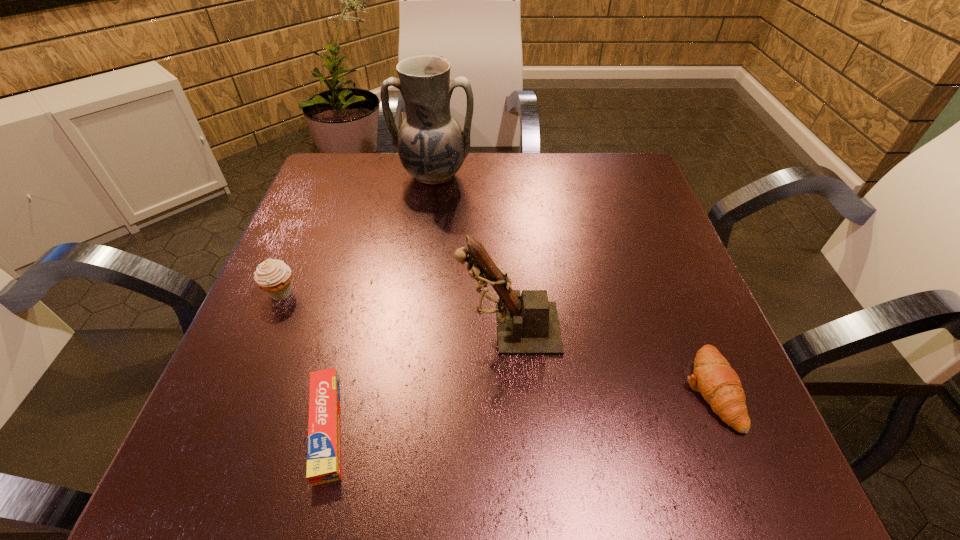
Where is `object positioned at the right edge`? Image resolution: width=960 pixels, height=540 pixels. object positioned at the right edge is located at coordinates (719, 384).

Locate an element on the screen. object positioned at the near left corner is located at coordinates coord(323,451).

Locate an element on the screen. object present at the near right corner is located at coordinates (719, 384).

The height and width of the screenshot is (540, 960). Identify the location of free spot at the far edge of the desktop. (526, 158).

Image resolution: width=960 pixels, height=540 pixels. Find the location of `vacant space at the near edge of the desktop`. vacant space at the near edge of the desktop is located at coordinates (620, 450).

Where is `free space at the left edge`? The width and height of the screenshot is (960, 540). free space at the left edge is located at coordinates (259, 355).

The height and width of the screenshot is (540, 960). Identify the location of blank space at the right edge of the desktop. (639, 297).

I want to click on vacant space at the far left corner of the desktop, so click(x=381, y=173).

At what (x,y) coordinates should I click in order to perform the action: click on vacant space at the far right corner of the desktop. Please return your answer as a coordinate pair (x, y). This screenshot has width=960, height=540. Looking at the image, I should click on (654, 205).

The height and width of the screenshot is (540, 960). In order to click on unoccupied area between the toothpaste and the crescent roll in this screenshot , I will do `click(518, 408)`.